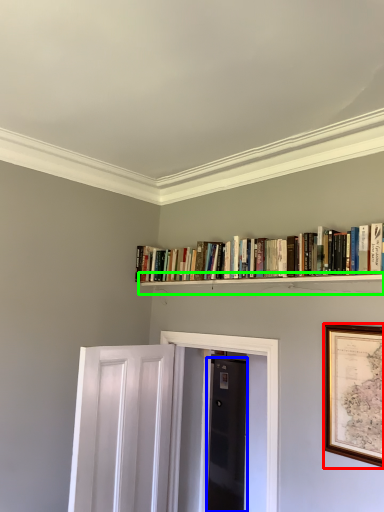
Question: Estimate the real-world distances between objects in this image. Which object is farther from picture frame (highlighted by a red box), door (highlighted by a blue box) or shelf (highlighted by a green box)?

Choices:
 (A) door
 (B) shelf

Answer: (A)